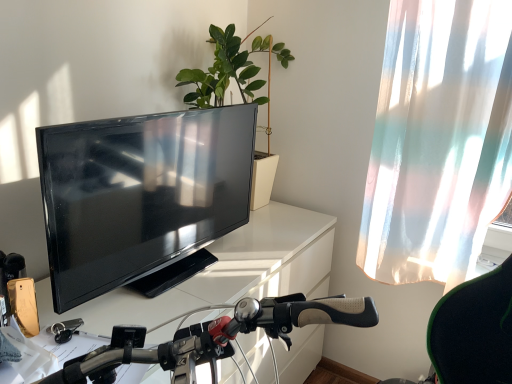
Question: Considering the relative positions of white glossy desk at center and green matte plant at upper center in the image provided, is white glossy desk at center to the right of green matte plant at upper center from the viewer's perspective?

Choices:
 (A) yes
 (B) no

Answer: (B)

Question: From a real-world perspective, is white glossy desk at center under green matte plant at upper center?

Choices:
 (A) yes
 (B) no

Answer: (A)

Question: Does white glossy desk at center turn towards green matte plant at upper center?

Choices:
 (A) yes
 (B) no

Answer: (B)

Question: Are white glossy desk at center and green matte plant at upper center located far from each other?

Choices:
 (A) no
 (B) yes

Answer: (A)

Question: From the image's perspective, is white glossy desk at center under green matte plant at upper center?

Choices:
 (A) no
 (B) yes

Answer: (B)

Question: From a real-world perspective, is green matte plant at upper center physically located above or below white glossy desk at center?

Choices:
 (A) below
 (B) above

Answer: (B)

Question: From the image's perspective, is green matte plant at upper center positioned above or below white glossy desk at center?

Choices:
 (A) above
 (B) below

Answer: (A)

Question: Considering the positions of point (212, 84) and point (260, 215), is point (212, 84) closer or farther from the camera than point (260, 215)?

Choices:
 (A) closer
 (B) farther

Answer: (A)

Question: In terms of height, does green matte plant at upper center look taller or shorter compared to white glossy desk at center?

Choices:
 (A) tall
 (B) short

Answer: (B)

Question: From the image's perspective, is matte black tv at left located above or below white glossy desk at center?

Choices:
 (A) above
 (B) below

Answer: (A)

Question: Is matte black tv at left inside or outside of white glossy desk at center?

Choices:
 (A) outside
 (B) inside

Answer: (A)

Question: From a real-world perspective, is matte black tv at left above or below white glossy desk at center?

Choices:
 (A) above
 (B) below

Answer: (A)

Question: Is point (168, 140) closer or farther from the camera than point (245, 228)?

Choices:
 (A) farther
 (B) closer

Answer: (B)

Question: In terms of height, does matte black tv at left look taller or shorter compared to green matte plant at upper center?

Choices:
 (A) short
 (B) tall

Answer: (A)

Question: From a real-world perspective, is matte black tv at left above or below green matte plant at upper center?

Choices:
 (A) below
 (B) above

Answer: (A)